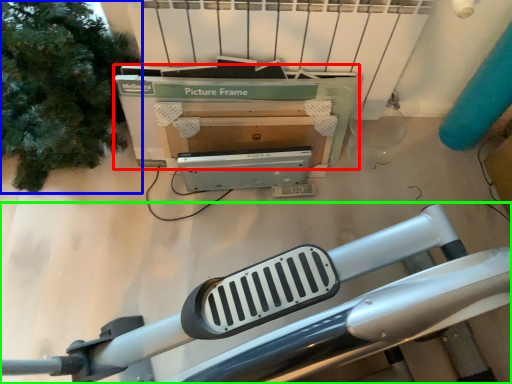
Question: Estimate the real-world distances between objects in this image. Which object is farther from box (highlighted by a red box), tree (highlighted by a blue box) or furniture (highlighted by a green box)?

Choices:
 (A) tree
 (B) furniture

Answer: (B)